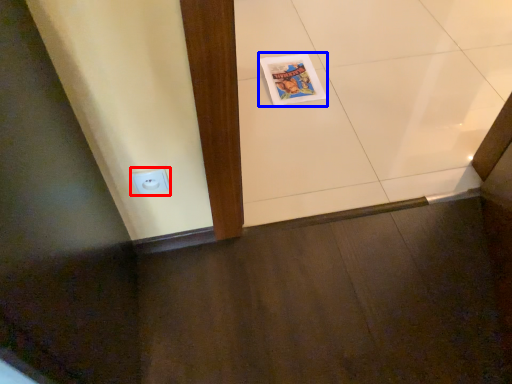
Question: Which object is further to the camera taking this photo, electric outlet (highlighted by a red box) or comic book (highlighted by a blue box)?

Choices:
 (A) electric outlet
 (B) comic book

Answer: (B)